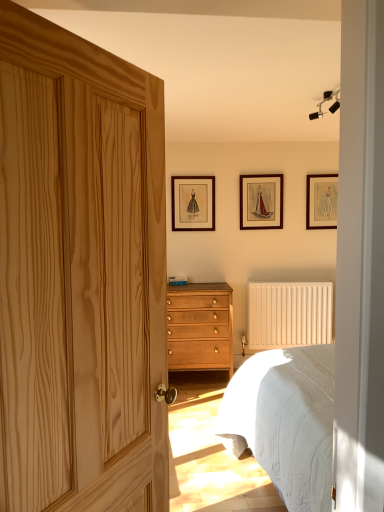
Question: Is wooden picture frame at upper center, the first picture frame in the left-to-right sequence, thinner than wooden picture frame at upper right, placed as the 3th picture frame when sorted from left to right?

Choices:
 (A) no
 (B) yes

Answer: (B)

Question: Does wooden picture frame at upper center, the first picture frame in the left-to-right sequence, have a greater width compared to wooden picture frame at upper right, placed as the first picture frame when sorted from right to left?

Choices:
 (A) no
 (B) yes

Answer: (A)

Question: Is wooden picture frame at upper center, which ranks as the third picture frame in right-to-left order, completely or partially outside of wooden picture frame at upper right, placed as the 3th picture frame when sorted from left to right?

Choices:
 (A) yes
 (B) no

Answer: (A)

Question: From a real-world perspective, is wooden picture frame at upper center, the first picture frame in the left-to-right sequence, located higher than wooden picture frame at upper right, placed as the 3th picture frame when sorted from left to right?

Choices:
 (A) yes
 (B) no

Answer: (A)

Question: Is wooden picture frame at upper center, the first picture frame in the left-to-right sequence, placed right next to wooden picture frame at upper right, placed as the first picture frame when sorted from right to left?

Choices:
 (A) no
 (B) yes

Answer: (A)

Question: Considering the positions of point click(337, 92) and point click(183, 180), is point click(337, 92) closer or farther from the camera than point click(183, 180)?

Choices:
 (A) farther
 (B) closer

Answer: (B)

Question: From the image's perspective, is black matte track lights at upper right positioned above or below wooden picture frame at upper center, which ranks as the third picture frame in right-to-left order?

Choices:
 (A) above
 (B) below

Answer: (A)

Question: Which is correct: black matte track lights at upper right is inside wooden picture frame at upper center, the first picture frame in the left-to-right sequence, or outside of it?

Choices:
 (A) inside
 (B) outside

Answer: (B)

Question: Considering the relative positions of black matte track lights at upper right and wooden picture frame at upper center, which ranks as the third picture frame in right-to-left order, in the image provided, is black matte track lights at upper right to the left or to the right of wooden picture frame at upper center, which ranks as the third picture frame in right-to-left order,?

Choices:
 (A) left
 (B) right

Answer: (B)

Question: Considering their positions, is wooden picture frame at upper right, placed as the first picture frame when sorted from right to left, located in front of or behind black matte track lights at upper right?

Choices:
 (A) behind
 (B) front

Answer: (A)

Question: Based on their positions, is wooden picture frame at upper right, placed as the first picture frame when sorted from right to left, located to the left or right of black matte track lights at upper right?

Choices:
 (A) left
 (B) right

Answer: (B)

Question: Is wooden picture frame at upper right, placed as the first picture frame when sorted from right to left, wider or thinner than black matte track lights at upper right?

Choices:
 (A) wide
 (B) thin

Answer: (B)

Question: From a real-world perspective, is wooden picture frame at upper right, placed as the first picture frame when sorted from right to left, positioned above or below black matte track lights at upper right?

Choices:
 (A) below
 (B) above

Answer: (A)

Question: From a real-world perspective, is black matte track lights at upper right positioned above or below beige textured radiator at lower right?

Choices:
 (A) below
 (B) above

Answer: (B)

Question: Based on their sizes in the image, would you say black matte track lights at upper right is bigger or smaller than beige textured radiator at lower right?

Choices:
 (A) big
 (B) small

Answer: (B)